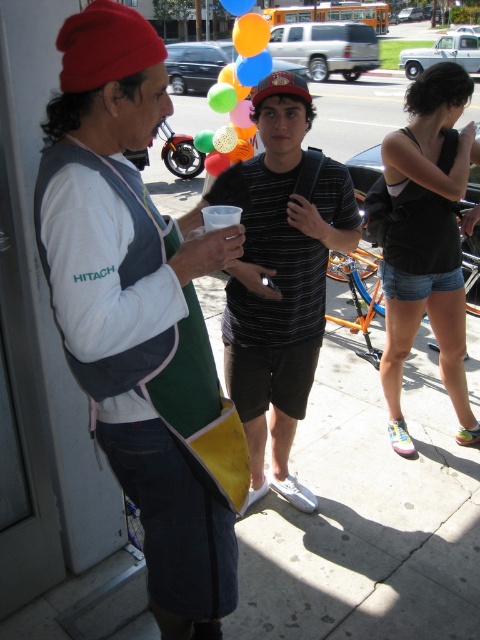
Question: Which point is farther to the camera?

Choices:
 (A) multicolored balloons at center
 (B) orange glossy balloon at upper center
 (C) denim shorts at center
 (D) rubber balloon at upper center

Answer: (D)

Question: Estimate the real-world distances between objects in this image. Which object is closer to the matte white shirt at left?

Choices:
 (A) striped cotton shirt at center
 (B) multicolored balloons at center

Answer: (A)

Question: Is denim shorts at center wider than multicolored balloons at center?

Choices:
 (A) yes
 (B) no

Answer: (B)

Question: Which of the following is the farthest from the observer?

Choices:
 (A) orange glossy balloon at upper center
 (B) denim shorts at center
 (C) matte white shirt at left
 (D) rubber balloon at upper center

Answer: (D)

Question: Is matte white shirt at left in front of multicolored balloons at center?

Choices:
 (A) yes
 (B) no

Answer: (A)

Question: Does striped cotton shirt at center appear on the right side of rubber balloon at upper center?

Choices:
 (A) yes
 (B) no

Answer: (A)